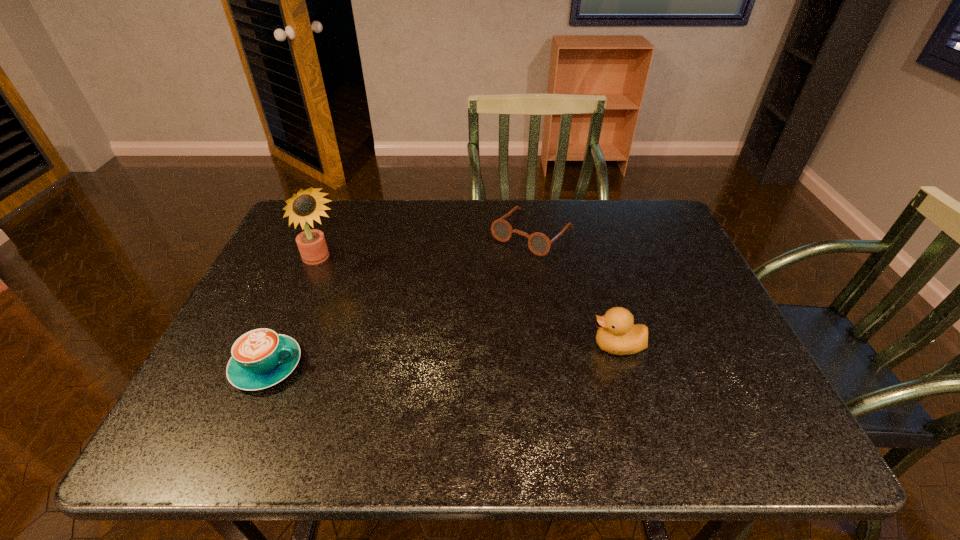
Locate an element on the screen. blank space at the near edge of the desktop is located at coordinates (348, 395).

You are a GUI agent. You are given a task and a screenshot of the screen. Output one action in this format:
    pyautogui.click(x=<x>, y=<y>)
    Task: Click on the vacant space at the left edge of the desktop
    Image resolution: width=960 pixels, height=540 pixels.
    Given the screenshot: What is the action you would take?
    pyautogui.click(x=300, y=269)

Where is `free space at the right edge of the desktop`? The height and width of the screenshot is (540, 960). free space at the right edge of the desktop is located at coordinates (728, 330).

The height and width of the screenshot is (540, 960). I want to click on vacant region at the near left corner of the desktop, so click(x=205, y=376).

In order to click on vacant space at the far right corner in this screenshot , I will do `click(663, 227)`.

This screenshot has height=540, width=960. What are the coordinates of `vacant area between the cappuccino and the sunflower` in the screenshot? It's located at (295, 314).

The width and height of the screenshot is (960, 540). I want to click on vacant point located between the cappuccino and the spectacles, so click(x=399, y=299).

Identify the location of vacant region between the third shortest object and the spectacles. (575, 289).

This screenshot has height=540, width=960. I want to click on vacant space in between the spectacles and the cappuccino, so click(x=399, y=299).

Locate an element on the screen. This screenshot has width=960, height=540. vacant point located between the cappuccino and the second tallest object is located at coordinates (442, 356).